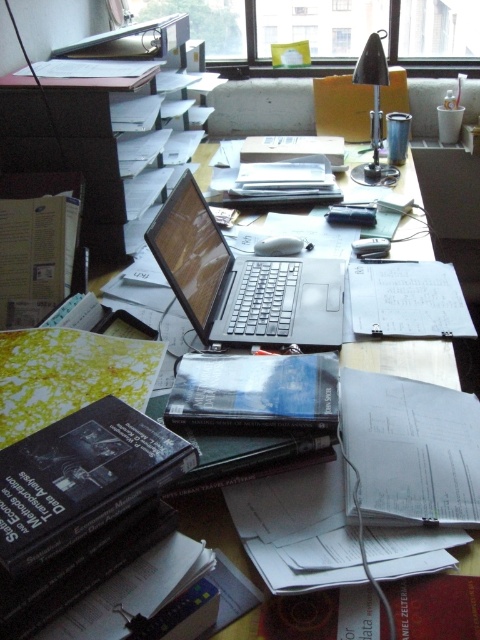
Based on the photo, you are organizing the desk and need to place a new item between the black matte binder at lower left and the black metallic lamp at upper right. Based on their positions, where should you position the new item?

The new item should be placed between the black matte binder at lower left and the black metallic lamp at upper right, positioned above the black matte binder at lower left and below the black metallic lamp at upper right since the binder is below the lamp.

You are organizing the items on your desk. You need to place a new item that requires more space than the existing items. Which object between the satin black laptop at center and the black metallic lamp at upper right should you consider moving first?

The satin black laptop at center has a larger size compared to the black metallic lamp at upper right, so you should consider moving the satin black laptop at center first since it occupies more space.

Where is the satin black laptop at center located in the image?

The satin black laptop at center is located at point 0.441 on the x axis and 0.506 on the y axis.